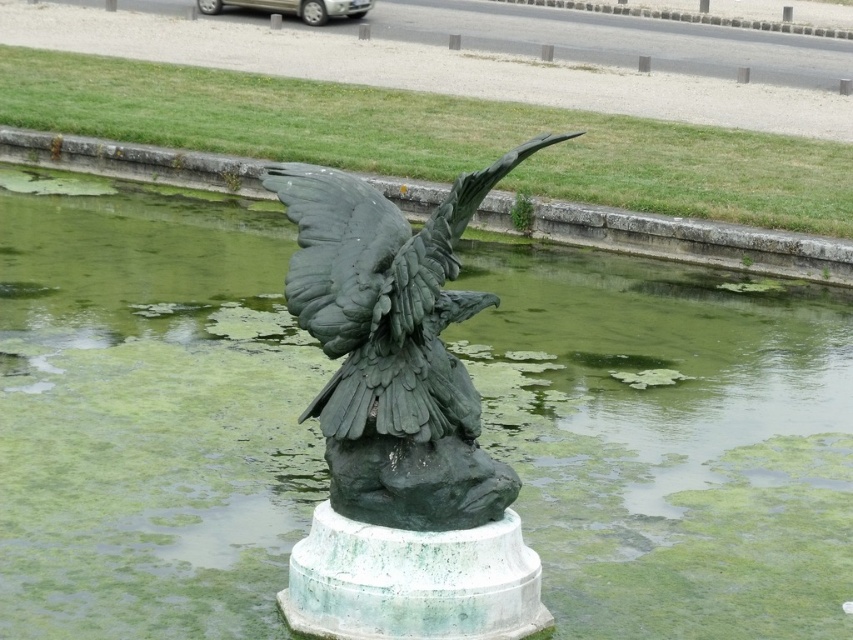
The width and height of the screenshot is (853, 640). Describe the element at coordinates (148, 412) in the screenshot. I see `green algae water at center` at that location.

Does point (250, 577) come behind point (387, 477)?

Yes.

Locate an element on the screen. green algae water at center is located at coordinates (148, 412).

Find the location of a particular element. The height and width of the screenshot is (640, 853). green algae water at center is located at coordinates (148, 412).